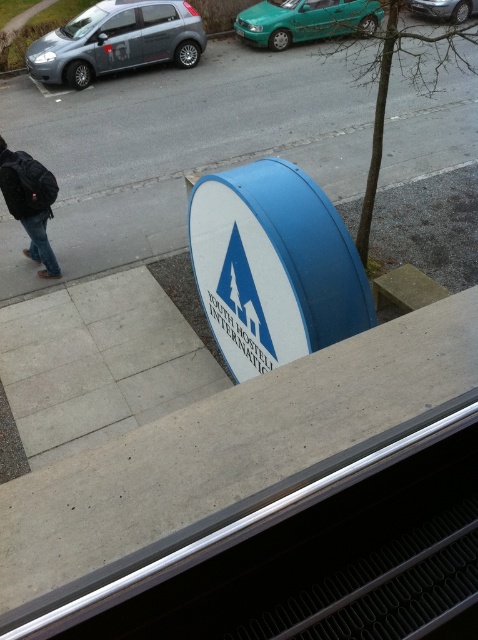
Looking at this image, you are standing at the corner of the street and want to cross to the other side. There is a matte gray hatchback at upper left in the image. Based on its position in the image, approximately where should you look for the matte gray hatchback in real life?

The matte gray hatchback at upper left is located at coordinates 0.064 on the x axis and 0.245 on the y axis in the image, so in real life, you should look towards the upper left direction from your current position.